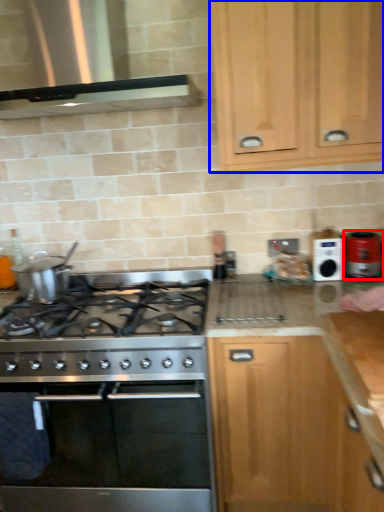
Question: Which object appears closest to the camera in this image, kitchen appliance (highlighted by a red box) or cabinetry (highlighted by a blue box)?

Choices:
 (A) kitchen appliance
 (B) cabinetry

Answer: (B)